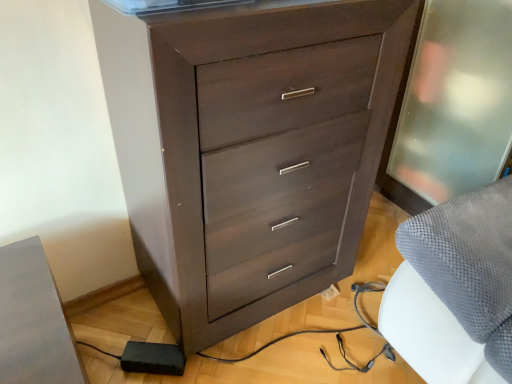
What do you see at coordinates (262, 157) in the screenshot?
I see `dark wood chest of drawers at center` at bounding box center [262, 157].

Locate an element on the screen. The image size is (512, 384). dark wood chest of drawers at center is located at coordinates [262, 157].

At what (x,y) coordinates should I click in order to perform the action: click on dark wood chest of drawers at center. Please return your answer as a coordinate pair (x, y). Looking at the image, I should click on (262, 157).